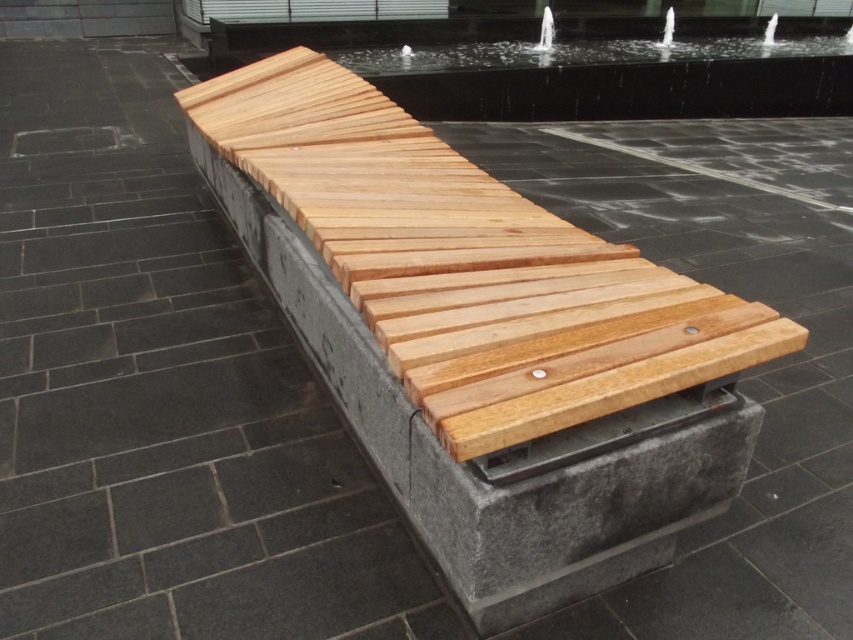
You are standing at the point with coordinates point (474, 337). Looking around, you see the natural wood bench at center. Based on the scene description, what is the material of the bench seat?

The bench seat is made of light colored wooden slats arranged in a slightly overlapping manner, so the material is natural wood.